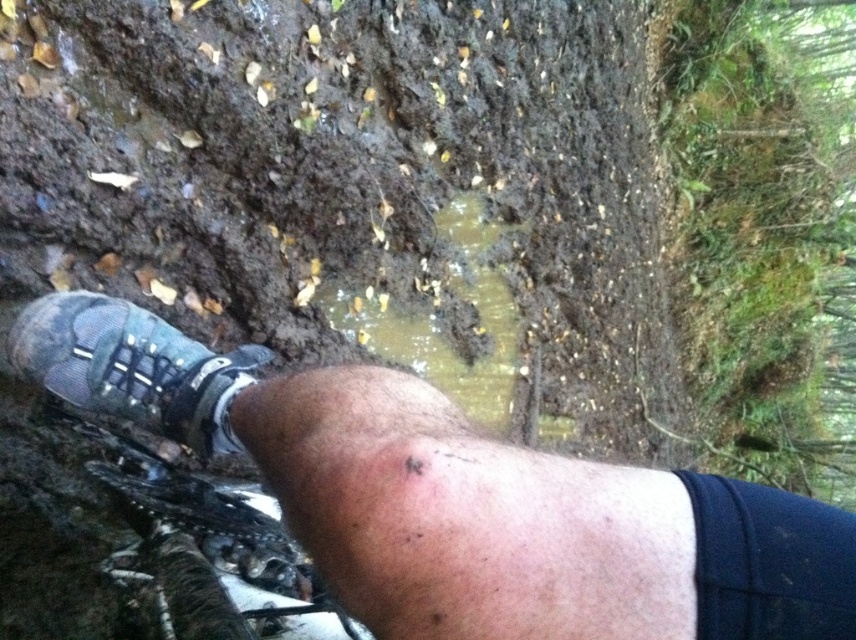
Between textured gray shoe at lower left and matte mesh shoe at lower left, which one is positioned lower?

textured gray shoe at lower left is below.

Between point (664, 484) and point (69, 378), which one is positioned in front?

Positioned in front is point (664, 484).

This screenshot has height=640, width=856. What do you see at coordinates (458, 497) in the screenshot?
I see `textured gray shoe at lower left` at bounding box center [458, 497].

Where is `textured gray shoe at lower left`? The height and width of the screenshot is (640, 856). textured gray shoe at lower left is located at coordinates (458, 497).